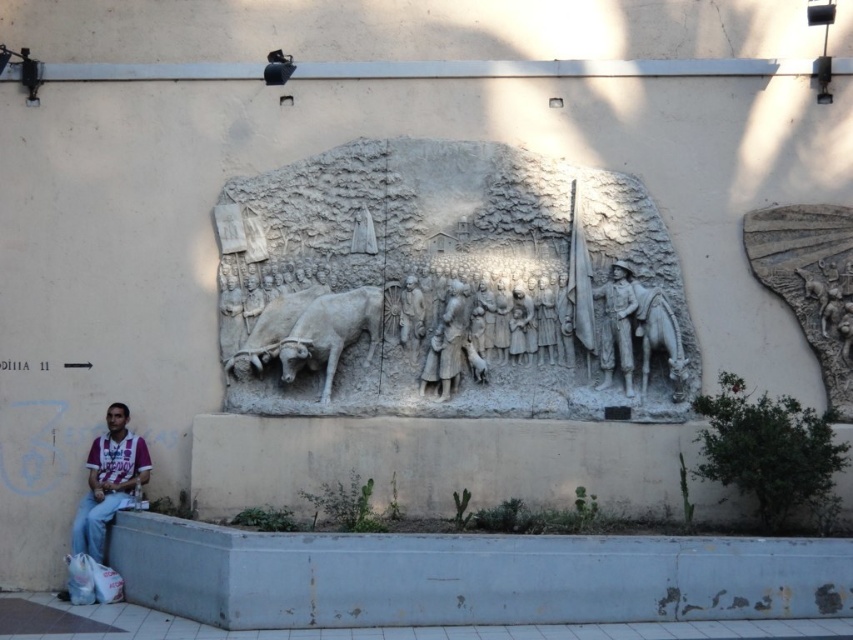
Question: Considering the relative positions of white stone relief at center and white stone cow at center in the image provided, where is white stone relief at center located with respect to white stone cow at center?

Choices:
 (A) below
 (B) above

Answer: (B)

Question: Which object appears closest to the camera in this image?

Choices:
 (A) maroon jersey at lower left
 (B) gray stone figures at center
 (C) white stone oxen at center
 (D) gray stone horse at center

Answer: (A)

Question: Estimate the real-world distances between objects in this image. Which object is farther from the white stone cow at center?

Choices:
 (A) gray stone figures at center
 (B) white stone oxen at center

Answer: (A)

Question: Can you confirm if white stone relief at center is positioned to the left of white stone oxen at center?

Choices:
 (A) yes
 (B) no

Answer: (B)

Question: In this image, where is gray stone horse at center located relative to stone figure at center?

Choices:
 (A) left
 (B) right

Answer: (B)

Question: Which object appears farthest from the camera in this image?

Choices:
 (A) gray stone figures at center
 (B) white stone relief at center

Answer: (A)